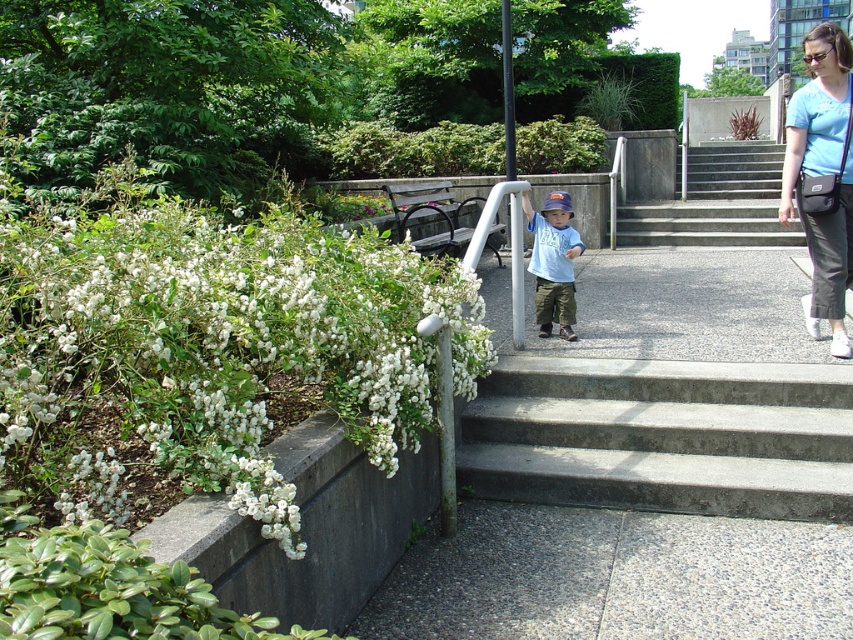
Question: Can you confirm if gray concrete stairs at center is wider than concrete stairs at center?

Choices:
 (A) yes
 (B) no

Answer: (B)

Question: Which of the following is the closest to the observer?

Choices:
 (A) (96, 516)
 (B) (715, 202)

Answer: (A)

Question: Which point is farther to the camera?

Choices:
 (A) (808, 104)
 (B) (567, 264)
 (C) (764, 236)
 (D) (561, 413)

Answer: (C)

Question: Which is farther from the white fluffy flowers at left?

Choices:
 (A) blue t-shirt at upper right
 (B) concrete stairs at center
 (C) gray concrete stairs at center
 (D) matte blue shirt at center

Answer: (B)

Question: Does white fluffy flowers at left have a smaller size compared to concrete stairs at center?

Choices:
 (A) yes
 (B) no

Answer: (A)

Question: Can you confirm if concrete stairs at center is wider than matte blue shirt at center?

Choices:
 (A) yes
 (B) no

Answer: (A)